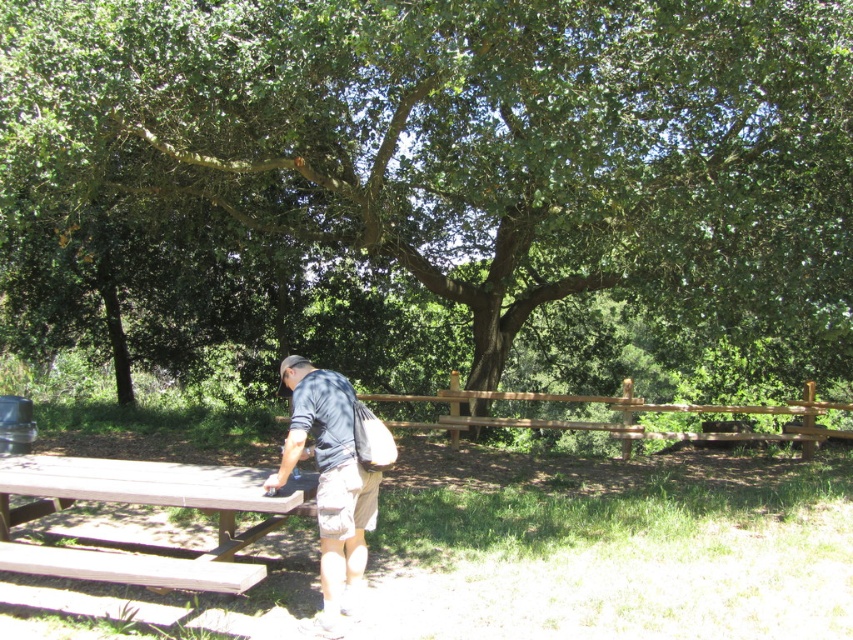
Question: Which point is farther from the camera taking this photo?

Choices:
 (A) (349, 552)
 (B) (38, 500)

Answer: (B)

Question: From the image, what is the correct spatial relationship of brown wood picnic table at lower left in relation to dark blue shirt at center?

Choices:
 (A) right
 (B) left

Answer: (B)

Question: Which of the following is the farthest from the observer?

Choices:
 (A) brown wood picnic table at lower left
 (B) dark blue shirt at center
 (C) green leafy tree at center

Answer: (C)

Question: Does brown wood picnic table at lower left lie behind dark blue shirt at center?

Choices:
 (A) yes
 (B) no

Answer: (B)

Question: Does green leafy tree at center have a larger size compared to brown wood picnic table at lower left?

Choices:
 (A) yes
 (B) no

Answer: (A)

Question: Which point is closer to the camera taking this photo?

Choices:
 (A) (527, 337)
 (B) (186, 588)
 (C) (351, 474)

Answer: (B)